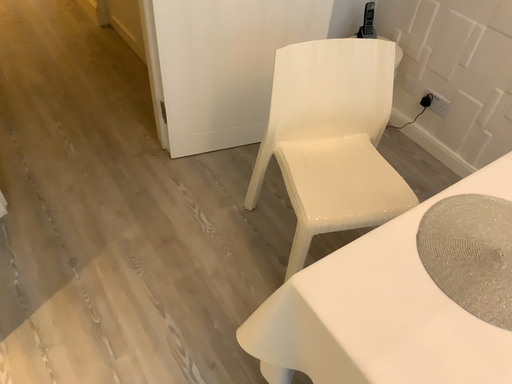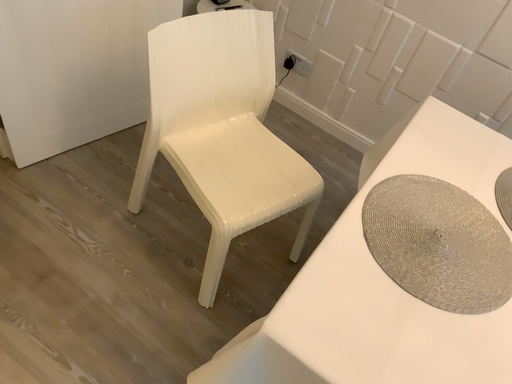
Question: Which way did the camera rotate in the video?

Choices:
 (A) rotated right
 (B) rotated left

Answer: (A)